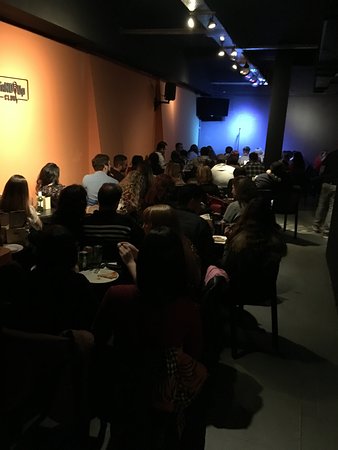
Locate an element on the screen. Image resolution: width=338 pixels, height=450 pixels. chairs is located at coordinates (273, 304), (31, 375), (133, 414), (291, 209).